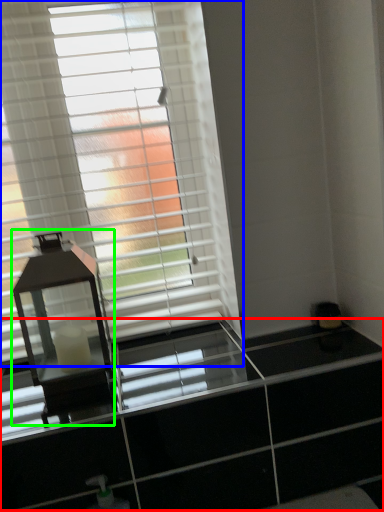
Question: Estimate the real-world distances between objects in this image. Which object is closer to dresser (highlighted by a red box), window blind (highlighted by a blue box) or table lamp (highlighted by a green box)?

Choices:
 (A) window blind
 (B) table lamp

Answer: (B)